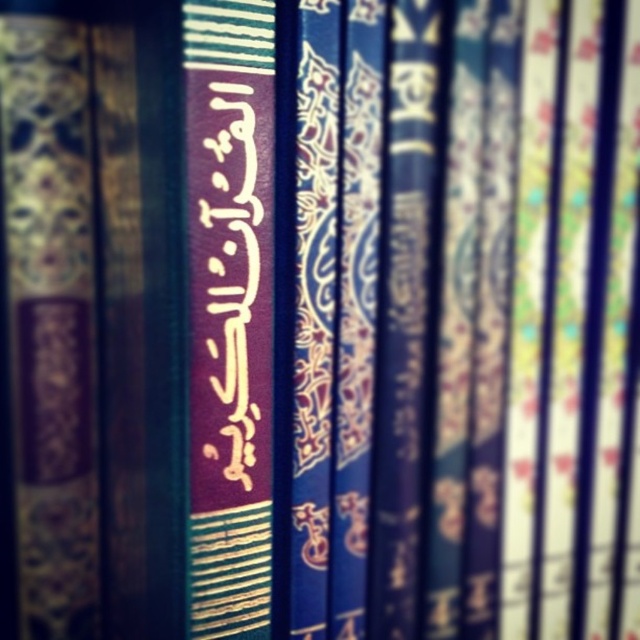
From the picture: Who is positioned more to the right, matte gold text at center or dark purple paper at center?

dark purple paper at center

Which is above, matte gold text at center or dark purple paper at center?

dark purple paper at center is above.

Where is `matte gold text at center`? The image size is (640, 640). matte gold text at center is located at coordinates (228, 310).

You are a GUI agent. You are given a task and a screenshot of the screen. Output one action in this format:
    pyautogui.click(x=<x>, y=<y>)
    Task: Click on the matte gold text at center
    
    Given the screenshot: What is the action you would take?
    pyautogui.click(x=228, y=310)